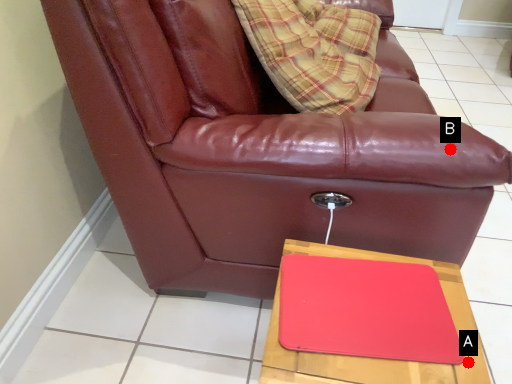
Question: Two points are circled on the image, labeled by A and B beside each circle. Which of the following is the farthest from the observer?

Choices:
 (A) A is further
 (B) B is further

Answer: (B)